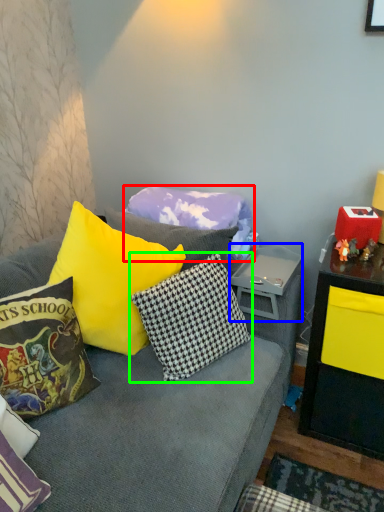
Question: Which object is the closest to the pillow (highlighted by a red box)? Choose among these: side table (highlighted by a blue box) or pillow (highlighted by a green box).

Choices:
 (A) side table
 (B) pillow

Answer: (A)